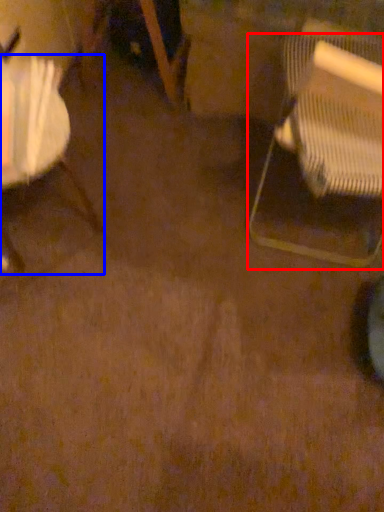
Question: Which object appears closest to the camera in this image, chair (highlighted by a red box) or chair (highlighted by a blue box)?

Choices:
 (A) chair
 (B) chair

Answer: (A)